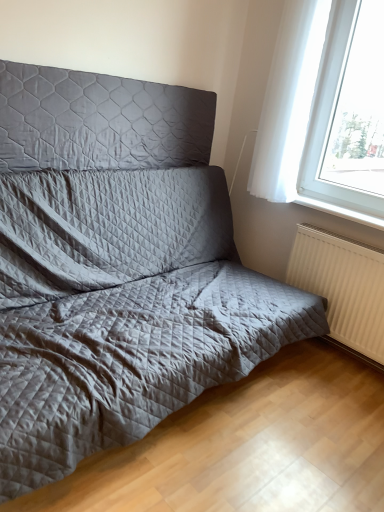
Question: Looking at the image, does white glossy window sill at lower right seem bigger or smaller compared to quilted fabric headboard at upper left?

Choices:
 (A) big
 (B) small

Answer: (B)

Question: Would you say white glossy window sill at lower right is to the left or to the right of quilted fabric headboard at upper left in the picture?

Choices:
 (A) right
 (B) left

Answer: (A)

Question: Considering the real-world distances, which object is farthest from the white textured radiator at lower right?

Choices:
 (A) white sheer curtain at upper right
 (B) white sheer curtain at upper right
 (C) quilted fabric headboard at upper left
 (D) white glossy window sill at lower right

Answer: (C)

Question: Which object is the farthest from the white sheer curtain at upper right?

Choices:
 (A) white glossy window sill at lower right
 (B) quilted fabric headboard at upper left
 (C) white textured radiator at lower right
 (D) white sheer curtain at upper right

Answer: (B)